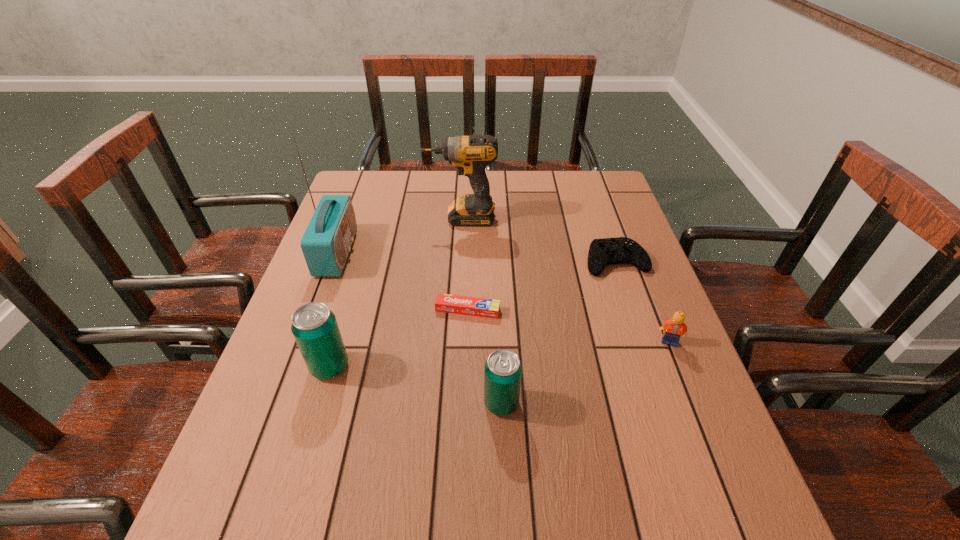
This screenshot has height=540, width=960. I want to click on the left beer can, so click(x=314, y=326).

The width and height of the screenshot is (960, 540). I want to click on the taller beer can, so click(314, 326).

Identify the location of the nearer beer can. (503, 370).

Where is `the fourth shortest object`? The height and width of the screenshot is (540, 960). the fourth shortest object is located at coordinates (503, 370).

Where is `the second tallest object`? Image resolution: width=960 pixels, height=540 pixels. the second tallest object is located at coordinates (471, 154).

I want to click on drill, so click(x=471, y=154).

Find the location of a particular element. This screenshot has width=960, height=540. Lego is located at coordinates (675, 328).

Where is `the fifth farthest object`? This screenshot has width=960, height=540. the fifth farthest object is located at coordinates (675, 328).

The height and width of the screenshot is (540, 960). What are the coordinates of `the tallest object` in the screenshot? It's located at (326, 243).

In order to click on the second shortest object in this screenshot , I will do `click(621, 250)`.